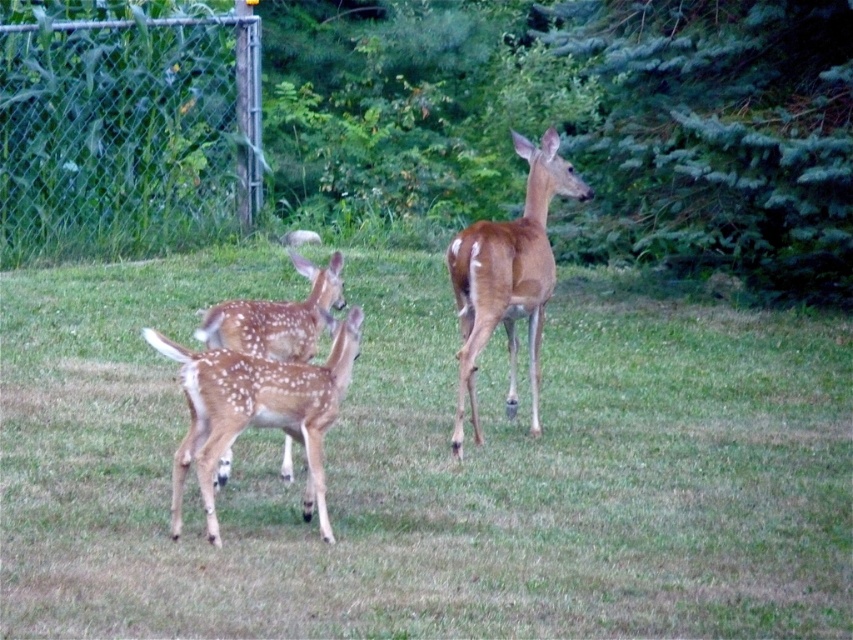
Question: Does green grass at center have a lesser width compared to brown matte/deer at center?

Choices:
 (A) no
 (B) yes

Answer: (B)

Question: From the image, what is the correct spatial relationship of green grass at center in relation to brown matte/deer at center?

Choices:
 (A) left
 (B) right

Answer: (A)

Question: Considering the real-world distances, which object is farthest from the brown matte/deer at center?

Choices:
 (A) green grass at center
 (B) spotted fur deer at center
 (C) metal chain-link fence at upper left
 (D) spotted fur fawn at center

Answer: (C)

Question: Which of these objects is positioned farthest from the spotted fur fawn at center?

Choices:
 (A) green grass at center
 (B) spotted fur deer at center

Answer: (A)

Question: Is green grass at center to the right of brown matte/deer at center from the viewer's perspective?

Choices:
 (A) no
 (B) yes

Answer: (A)

Question: Estimate the real-world distances between objects in this image. Which object is closer to the spotted fur deer at center?

Choices:
 (A) spotted fur fawn at center
 (B) green grass at center
 (C) brown matte/deer at center

Answer: (A)